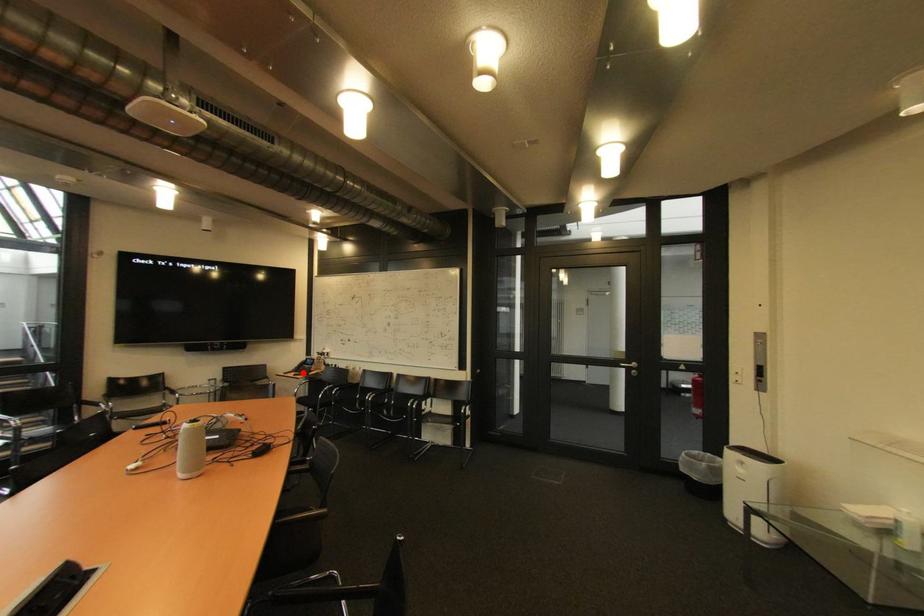
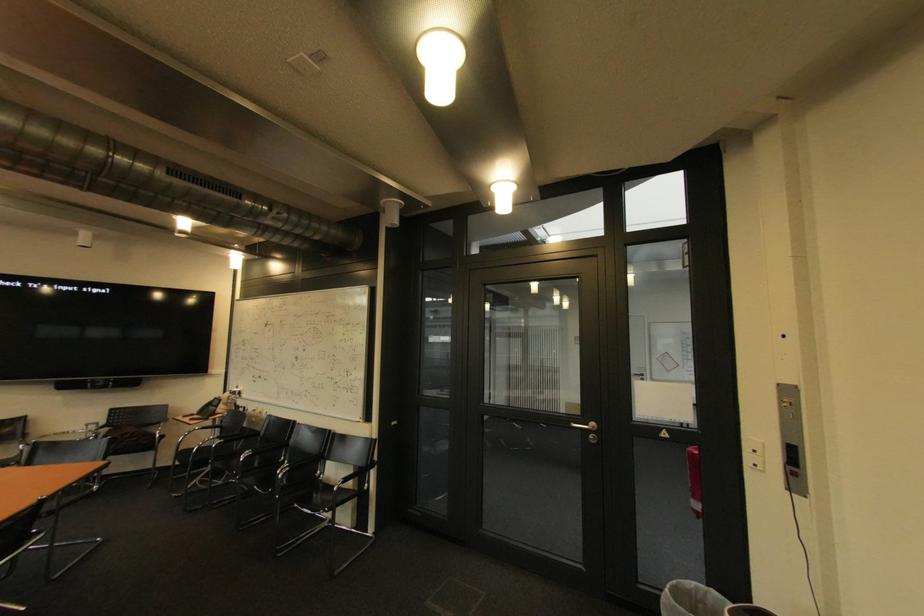
Find the pixel in the second image that matches the highlighted location in the first image.

(204, 416)